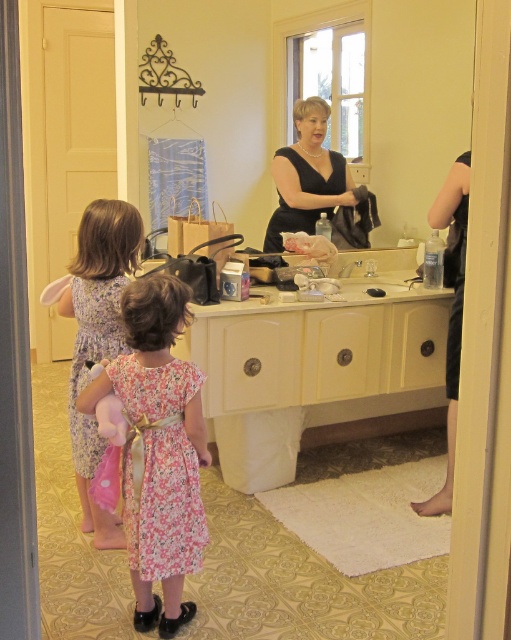
What is the position of the black glossy mirror at upper center in the bathroom scene?

The black glossy mirror at upper center is located at point 0.150 on the x axis and 0.436 on the y axis.

You are helping a customer choose between the black satin dress at center and the black matte dress at right. Which dress is positioned closer to the front of the vanity area?

The black satin dress at center is positioned closer to the front of the vanity area because the black matte dress at right is behind it.

You are standing in the bathroom and see two points marked in the scene. The first point is at coordinates point [77,320] and the second is at point [347,168]. Which point is closer to you?

Point [77,320] is in front of point [347,168], so the first point is closer to you.